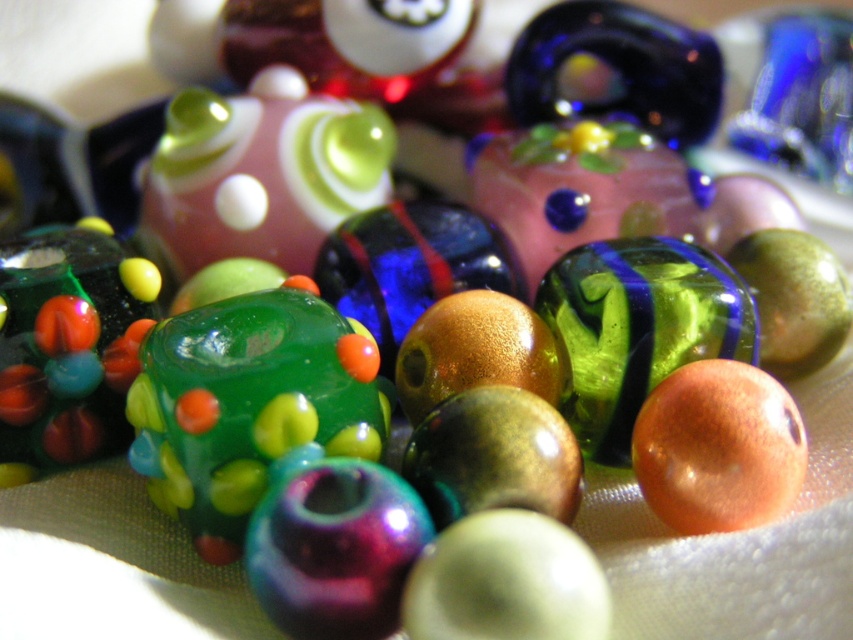
You are an interior designer arranging these beads on a shelf. The shelf is 12 inches wide. If you want to place both the green glossy bead at center and the matte glass bead at center on the shelf, will they fit side by side without overlapping?

The green glossy bead at center is 12.48 inches from the matte glass bead at center. Since the shelf is only 12 inches wide, placing them side by side would require at least 12.48 inches of space, which exceeds the shelf width. Therefore, they cannot fit without overlapping.